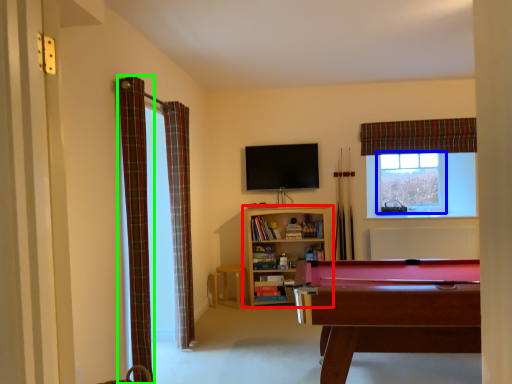
Question: Based on their relative distances, which object is farther from bookcase (highlighted by a red box)? Choose from window frame (highlighted by a blue box) and curtain (highlighted by a green box).

Choices:
 (A) window frame
 (B) curtain

Answer: (B)